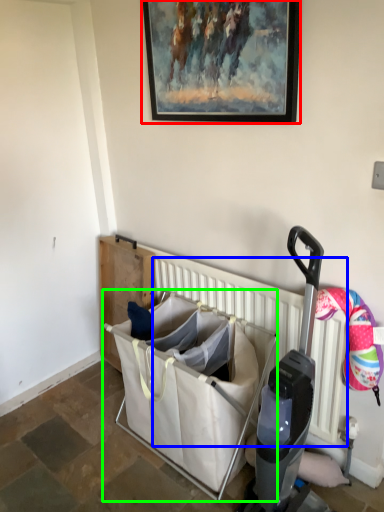
Question: Which object is positioned closest to picture frame (highlighted by a red box)? Select from radiator (highlighted by a blue box) and baby carriage (highlighted by a green box).

Choices:
 (A) radiator
 (B) baby carriage

Answer: (A)